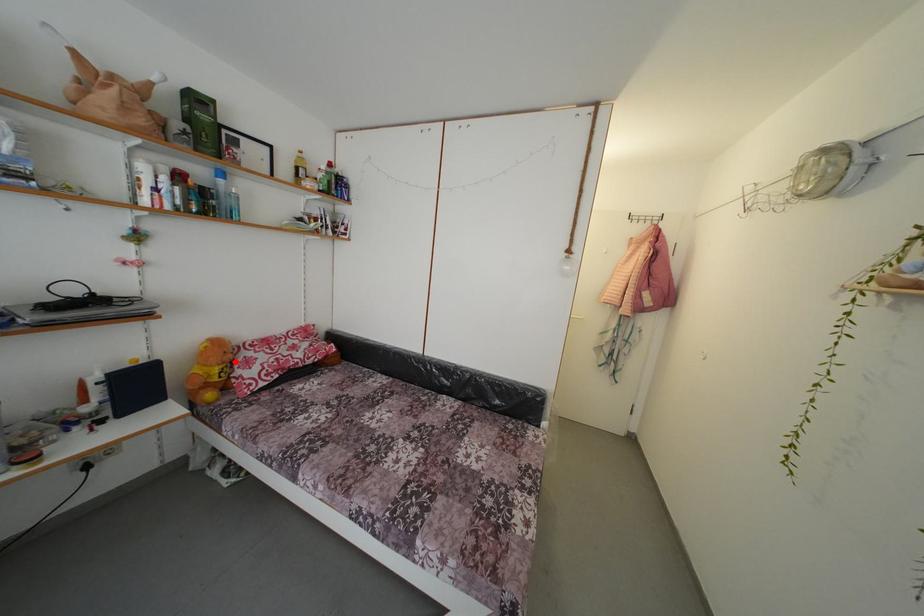
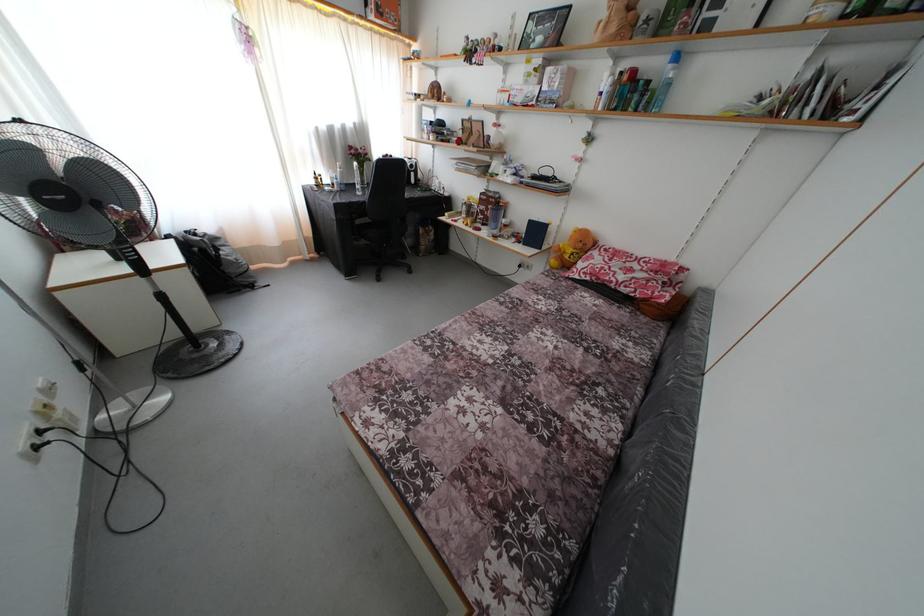
Locate, in the second image, the point that corresponds to the highlighted location in the first image.

(585, 251)